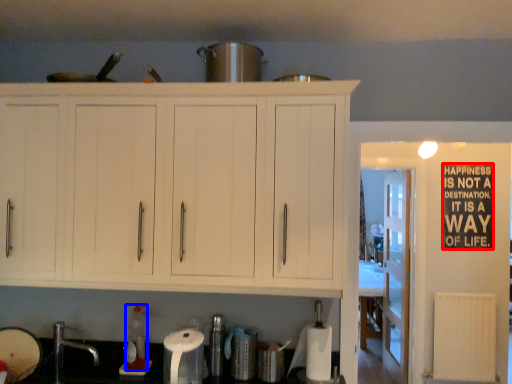
Question: Which object is further to the camera taking this photo, bulletin board (highlighted by a red box) or bottle (highlighted by a blue box)?

Choices:
 (A) bulletin board
 (B) bottle

Answer: (A)